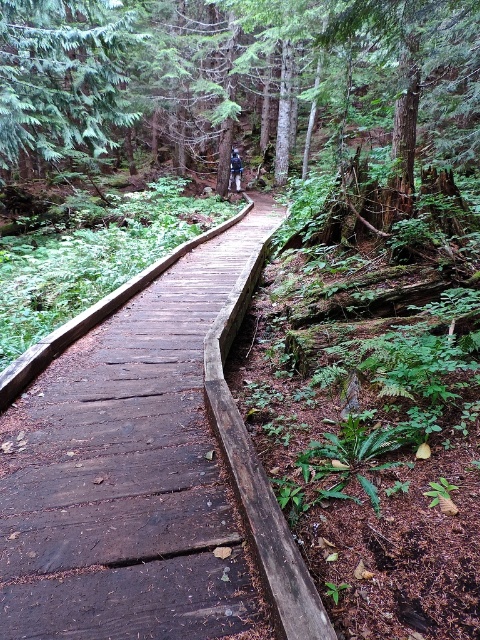
You are standing at the start of the brown wooden boardwalk at center and want to take a photo of the green matte tree at upper left. Which direction should you face to capture the tree in your view?

You should face to the left because the brown wooden boardwalk at center is to the right of the green matte tree at upper left, meaning the tree is located to the left of the boardwalk.

You are a hiker standing on the brown wooden boardwalk at center. You notice a green matte tree at upper left. Which object is closer to the ground?

The brown wooden boardwalk at center is positioned under the green matte tree at upper left, meaning the boardwalk is closer to the ground than the tree.